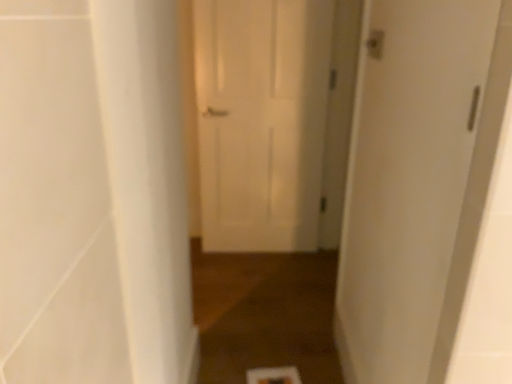
Question: In which direction should I rotate to look at white matte door at center, the second door from the right?

Choices:
 (A) right
 (B) left

Answer: (A)

Question: Is white smooth pillar at left looking in the opposite direction of white matte door at center, the second door from the right?

Choices:
 (A) no
 (B) yes

Answer: (A)

Question: From the image's perspective, is white smooth pillar at left located above white matte door at center, acting as the second door starting from the front?

Choices:
 (A) yes
 (B) no

Answer: (B)

Question: Is white smooth pillar at left wider than white matte door at center, the first door in the left-to-right sequence?

Choices:
 (A) yes
 (B) no

Answer: (B)

Question: Is white smooth pillar at left oriented towards white matte door at center, the second door from the right?

Choices:
 (A) yes
 (B) no

Answer: (B)

Question: Does white smooth pillar at left have a greater height compared to white matte door at center, acting as the second door starting from the front?

Choices:
 (A) yes
 (B) no

Answer: (B)

Question: Is white smooth pillar at left further to the viewer compared to white matte door at center, acting as the second door starting from the front?

Choices:
 (A) yes
 (B) no

Answer: (B)

Question: Is white matte door at center, placed as the 1th door when sorted from back to front, further to camera compared to white matte door at right, arranged as the second door when viewed from the left?

Choices:
 (A) no
 (B) yes

Answer: (B)

Question: From the image's perspective, is white matte door at center, placed as the 1th door when sorted from back to front, below white matte door at right, which ranks as the first door in front-to-back order?

Choices:
 (A) no
 (B) yes

Answer: (A)

Question: Is white matte door at right, arranged as the second door when viewed from the left, surrounded by white matte door at center, placed as the 1th door when sorted from back to front?

Choices:
 (A) no
 (B) yes

Answer: (A)

Question: Is white matte door at center, the second door from the right, with white matte door at right, marked as the 2th door in a back-to-front arrangement?

Choices:
 (A) no
 (B) yes

Answer: (A)

Question: Does white matte door at center, the first door in the left-to-right sequence, have a greater width compared to white matte door at right, arranged as the first door when viewed from the right?

Choices:
 (A) yes
 (B) no

Answer: (A)

Question: Is white matte door at center, acting as the second door starting from the front, turned away from white matte door at right, which ranks as the first door in front-to-back order?

Choices:
 (A) yes
 (B) no

Answer: (B)

Question: Does white matte door at center, the second door from the right, have a larger size compared to brown wood floor at center?

Choices:
 (A) yes
 (B) no

Answer: (A)